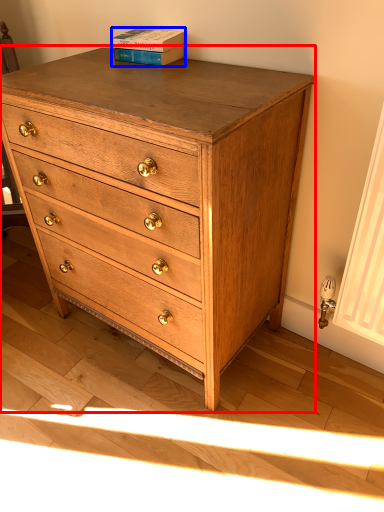
Question: Which object is further to the camera taking this photo, chest of drawers (highlighted by a red box) or paperback book (highlighted by a blue box)?

Choices:
 (A) chest of drawers
 (B) paperback book

Answer: (B)